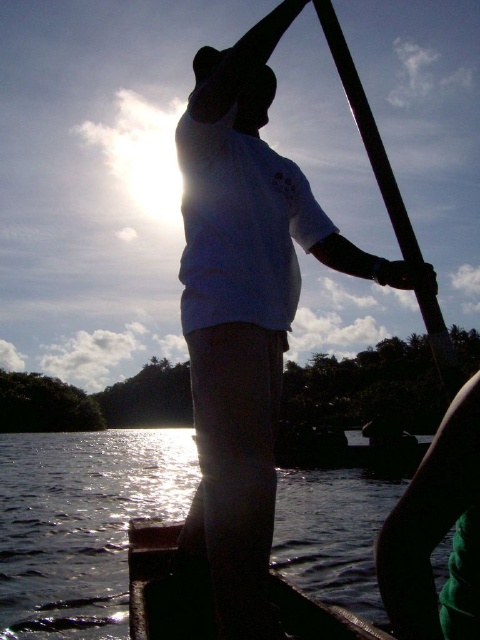
Question: Does glistening water at lower left have a lesser width compared to dark wood boat at center?

Choices:
 (A) no
 (B) yes

Answer: (A)

Question: Where is white matte shirt at center located in relation to dark wood boat at center in the image?

Choices:
 (A) below
 (B) above

Answer: (B)

Question: Which object is positioned farthest from the white matte shirt at center?

Choices:
 (A) glistening water at lower left
 (B) dark wood boat at center

Answer: (A)

Question: Which of these objects is positioned closest to the glistening water at lower left?

Choices:
 (A) white matte shirt at center
 (B) dark wood boat at center
 (C) smooth black pole at upper center

Answer: (B)

Question: Which object is farther from the camera taking this photo?

Choices:
 (A) white matte shirt at center
 (B) glistening water at lower left
 (C) smooth black pole at upper center
 (D) dark wood boat at center

Answer: (B)

Question: In this image, where is glistening water at lower left located relative to smooth black pole at upper center?

Choices:
 (A) above
 (B) below

Answer: (B)